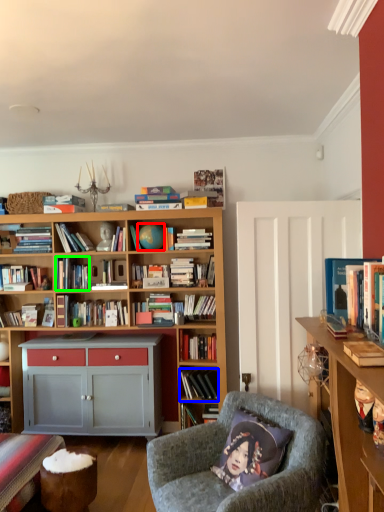
Question: Which object is the closest to the teal (highlighted by a red box)? Choose among these: book (highlighted by a blue box) or book (highlighted by a green box).

Choices:
 (A) book
 (B) book

Answer: (B)